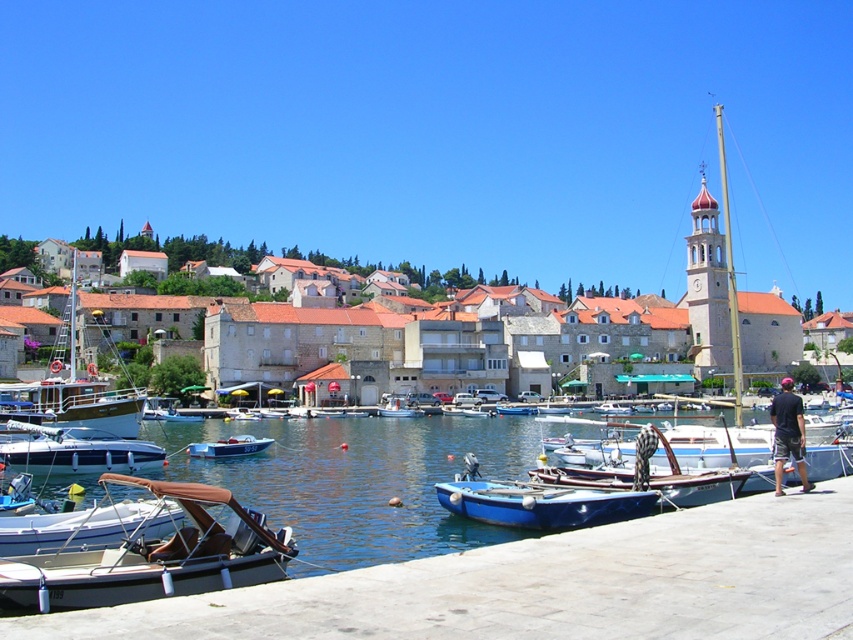
Between point (453, 534) and point (76, 394), which one is positioned in front?

Point (453, 534) is in front.

Who is shorter, blue smooth water at lower center or wooden sailboat at left?

blue smooth water at lower center

Is point (532, 428) in front of point (76, 369)?

Yes, point (532, 428) is closer to viewer.

Locate an element on the screen. blue smooth water at lower center is located at coordinates (360, 481).

Where is `matte stone buildings at center`? matte stone buildings at center is located at coordinates (637, 323).

Is point (257, 371) positioned behind point (88, 404)?

Yes, point (257, 371) is behind point (88, 404).

Which is in front, point (234, 355) or point (76, 404)?

Point (76, 404) is in front.

You are a GUI agent. You are given a task and a screenshot of the screen. Output one action in this format:
    pyautogui.click(x=<x>, y=<y>)
    Task: Click on the matte stone buildings at center
    
    Given the screenshot: What is the action you would take?
    pyautogui.click(x=637, y=323)

Is point (142, 506) positioned before point (218, 440)?

Yes, it is.

Between point (26, 538) and point (228, 454), which one is positioned in front?

Point (26, 538) is more forward.

Locate an element on the screen. The width and height of the screenshot is (853, 640). white plastic boat at lower left is located at coordinates (88, 525).

Identify the location of white plastic boat at lower left. (88, 525).